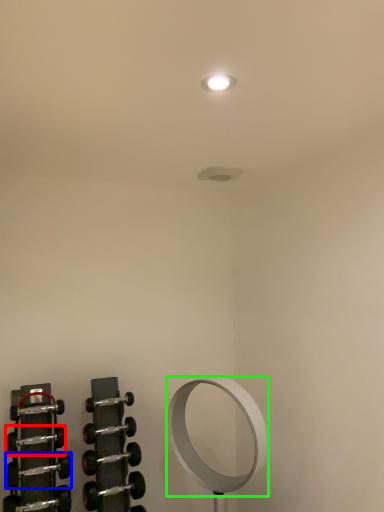
Question: Which object is positioned closest to dumbbell (highlighted by a red box)? Select from dumbbell (highlighted by a blue box) and mirror (highlighted by a green box).

Choices:
 (A) dumbbell
 (B) mirror

Answer: (A)